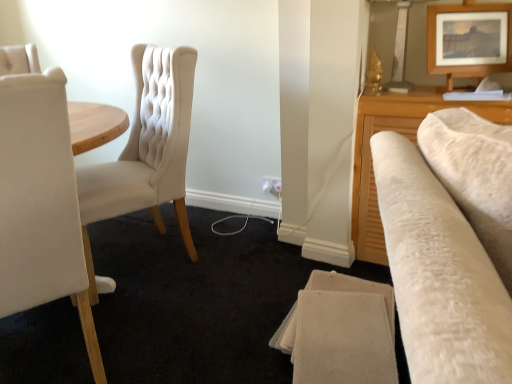
The height and width of the screenshot is (384, 512). In order to click on white leather chair at left, placed as the first chair when sorted from front to back in this screenshot , I will do `click(41, 203)`.

This screenshot has height=384, width=512. What do you see at coordinates (271, 184) in the screenshot? I see `white plastic electric outlet at lower center` at bounding box center [271, 184].

What do you see at coordinates (145, 152) in the screenshot?
I see `matte cream fabric chair at left, the 1th chair from the back` at bounding box center [145, 152].

This screenshot has height=384, width=512. I want to click on white leather chair at left, placed as the first chair when sorted from front to back, so click(x=41, y=203).

Can you confirm if matte cream fabric chair at left, the 2th chair when ordered from front to back, is positioned to the left of white leather chair at left, placed as the first chair when sorted from front to back?

No, matte cream fabric chair at left, the 2th chair when ordered from front to back, is not to the left of white leather chair at left, placed as the first chair when sorted from front to back.

From a real-world perspective, is matte cream fabric chair at left, the 2th chair when ordered from front to back, physically located above or below white leather chair at left, placed as the first chair when sorted from front to back?

From a real-world perspective, matte cream fabric chair at left, the 2th chair when ordered from front to back, is physically below white leather chair at left, placed as the first chair when sorted from front to back.

Can you confirm if matte cream fabric chair at left, the 1th chair from the back, is shorter than white leather chair at left, placed as the first chair when sorted from front to back?

Yes, matte cream fabric chair at left, the 1th chair from the back, is shorter than white leather chair at left, placed as the first chair when sorted from front to back.

Is point (172, 98) behind point (94, 377)?

Yes.

Is wooden picture frame at upper right beside matte cream fabric chair at left, the 1th chair from the back?

No, wooden picture frame at upper right is not beside matte cream fabric chair at left, the 1th chair from the back.

Consider the image. Based on their positions, is wooden picture frame at upper right located to the left or right of matte cream fabric chair at left, the 2th chair when ordered from front to back?

From the image, it's evident that wooden picture frame at upper right is to the right of matte cream fabric chair at left, the 2th chair when ordered from front to back.

Is wooden picture frame at upper right positioned behind matte cream fabric chair at left, the 2th chair when ordered from front to back?

Yes, it is.

Does point (436, 33) appear closer or farther from the camera than point (169, 194)?

Point (436, 33) is closer to the camera than point (169, 194).

Which point is more forward, (38, 205) or (462, 69)?

The point (38, 205) is more forward.

Measure the distance between white leather chair at left, the 2th chair when ordered from back to front, and wooden picture frame at upper right.

white leather chair at left, the 2th chair when ordered from back to front, is 1.56 meters away from wooden picture frame at upper right.

Is wooden picture frame at upper right at the back of white leather chair at left, placed as the first chair when sorted from front to back?

No, white leather chair at left, placed as the first chair when sorted from front to back,'s orientation is not away from wooden picture frame at upper right.

Considering the positions of objects wooden picture frame at upper right and white leather chair at left, placed as the first chair when sorted from front to back, in the image provided, who is in front, wooden picture frame at upper right or white leather chair at left, placed as the first chair when sorted from front to back,?

white leather chair at left, placed as the first chair when sorted from front to back, is more forward.

From the image's perspective, is wooden picture frame at upper right beneath white leather chair at left, placed as the first chair when sorted from front to back?

Incorrect, from the image's perspective, wooden picture frame at upper right is higher than white leather chair at left, placed as the first chair when sorted from front to back.

Would you say wooden picture frame at upper right is a long distance from white leather chair at left, the 2th chair when ordered from back to front?

wooden picture frame at upper right is positioned a significant distance from white leather chair at left, the 2th chair when ordered from back to front.

Considering the sizes of objects wooden picture frame at upper right and white plastic electric outlet at lower center in the image provided, who is shorter, wooden picture frame at upper right or white plastic electric outlet at lower center?

Standing shorter between the two is white plastic electric outlet at lower center.

Find the location of a particular element. This screenshot has height=384, width=512. electric outlet below the wooden picture frame at upper right (from a real-world perspective) is located at coordinates (271, 184).

What's the angular difference between wooden picture frame at upper right and white plastic electric outlet at lower center's facing directions?

28.4 degrees separate the facing orientations of wooden picture frame at upper right and white plastic electric outlet at lower center.

Consider the image. Is wooden picture frame at upper right behind white plastic electric outlet at lower center?

No.

From a real-world perspective, does matte cream fabric chair at left, the 2th chair when ordered from front to back, sit lower than wooden picture frame at upper right?

Yes, from a real-world perspective, matte cream fabric chair at left, the 2th chair when ordered from front to back, is under wooden picture frame at upper right.

Which of these two, matte cream fabric chair at left, the 2th chair when ordered from front to back, or wooden picture frame at upper right, stands taller?

With more height is matte cream fabric chair at left, the 2th chair when ordered from front to back.

Can wooden picture frame at upper right be found inside matte cream fabric chair at left, the 2th chair when ordered from front to back?

No, wooden picture frame at upper right is not a part of matte cream fabric chair at left, the 2th chair when ordered from front to back.

Can you confirm if matte cream fabric chair at left, the 2th chair when ordered from front to back, is positioned to the right of wooden picture frame at upper right?

In fact, matte cream fabric chair at left, the 2th chair when ordered from front to back, is to the left of wooden picture frame at upper right.

What's the angular difference between white plastic electric outlet at lower center and matte cream fabric chair at left, the 2th chair when ordered from front to back,'s facing directions?

white plastic electric outlet at lower center and matte cream fabric chair at left, the 2th chair when ordered from front to back, are facing 29.6 degrees away from each other.

Considering the relative sizes of white plastic electric outlet at lower center and matte cream fabric chair at left, the 1th chair from the back, in the image provided, is white plastic electric outlet at lower center bigger than matte cream fabric chair at left, the 1th chair from the back,?

Incorrect, white plastic electric outlet at lower center is not larger than matte cream fabric chair at left, the 1th chair from the back.

From a real-world perspective, is white plastic electric outlet at lower center on top of matte cream fabric chair at left, the 2th chair when ordered from front to back?

Incorrect, from a real-world perspective, white plastic electric outlet at lower center is lower than matte cream fabric chair at left, the 2th chair when ordered from front to back.

Could you tell me if white plastic electric outlet at lower center is facing matte cream fabric chair at left, the 2th chair when ordered from front to back?

No, white plastic electric outlet at lower center is not turned towards matte cream fabric chair at left, the 2th chair when ordered from front to back.

Find the location of a particular element. This screenshot has height=384, width=512. chair above the matte cream fabric chair at left, the 2th chair when ordered from front to back (from a real-world perspective) is located at coordinates (41, 203).

The height and width of the screenshot is (384, 512). Identify the location of the 1st chair in front of the wooden picture frame at upper right, counting from the anchor's position. (145, 152).

In the scene shown: Considering their positions, is white plastic electric outlet at lower center positioned closer to white leather chair at left, placed as the first chair when sorted from front to back, than wooden picture frame at upper right?

Based on the image, white plastic electric outlet at lower center appears to be nearer to white leather chair at left, placed as the first chair when sorted from front to back.

Which object lies further to the anchor point matte cream fabric chair at left, the 1th chair from the back, wooden picture frame at upper right or white plastic electric outlet at lower center?

Among the two, wooden picture frame at upper right is located further to matte cream fabric chair at left, the 1th chair from the back.

Estimate the real-world distances between objects in this image. Which object is further from white plastic electric outlet at lower center, white leather chair at left, placed as the first chair when sorted from front to back, or wooden picture frame at upper right?

Among the two, white leather chair at left, placed as the first chair when sorted from front to back, is located further to white plastic electric outlet at lower center.

Looking at this image, estimate the real-world distances between objects in this image. Which object is further from white plastic electric outlet at lower center, white leather chair at left, placed as the first chair when sorted from front to back, or matte cream fabric chair at left, the 1th chair from the back?

white leather chair at left, placed as the first chair when sorted from front to back, lies further to white plastic electric outlet at lower center than the other object.

When comparing their distances from wooden picture frame at upper right, does white leather chair at left, placed as the first chair when sorted from front to back, or white plastic electric outlet at lower center seem further?

white leather chair at left, placed as the first chair when sorted from front to back, is further to wooden picture frame at upper right.

Estimate the real-world distances between objects in this image. Which object is closer to wooden picture frame at upper right, matte cream fabric chair at left, the 2th chair when ordered from front to back, or white leather chair at left, the 2th chair when ordered from back to front?

matte cream fabric chair at left, the 2th chair when ordered from front to back, is closer to wooden picture frame at upper right.

Looking at the image, which one is located closer to wooden picture frame at upper right, white plastic electric outlet at lower center or matte cream fabric chair at left, the 2th chair when ordered from front to back?

Based on the image, white plastic electric outlet at lower center appears to be nearer to wooden picture frame at upper right.

Consider the image. Estimate the real-world distances between objects in this image. Which object is closer to white leather chair at left, placed as the first chair when sorted from front to back, wooden picture frame at upper right or white plastic electric outlet at lower center?

white plastic electric outlet at lower center.

Identify the location of electric outlet situated between matte cream fabric chair at left, the 2th chair when ordered from front to back, and wooden picture frame at upper right from left to right. The image size is (512, 384). (271, 184).

Find the location of `chair between white leather chair at left, the 2th chair when ordered from back to front, and white plastic electric outlet at lower center in the front-back direction`. chair between white leather chair at left, the 2th chair when ordered from back to front, and white plastic electric outlet at lower center in the front-back direction is located at coordinates point(145,152).

The height and width of the screenshot is (384, 512). I want to click on picture frame located between white leather chair at left, the 2th chair when ordered from back to front, and white plastic electric outlet at lower center in the depth direction, so click(x=443, y=34).

Locate an element on the screen. The height and width of the screenshot is (384, 512). chair between white leather chair at left, the 2th chair when ordered from back to front, and wooden picture frame at upper right, in the horizontal direction is located at coordinates point(145,152).